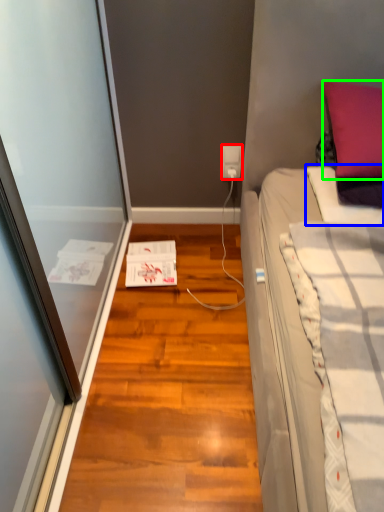
Question: Which object is the closest to the power outlet (highlighted by a red box)? Choose among these: blanket (highlighted by a blue box) or pillow (highlighted by a green box).

Choices:
 (A) blanket
 (B) pillow

Answer: (A)